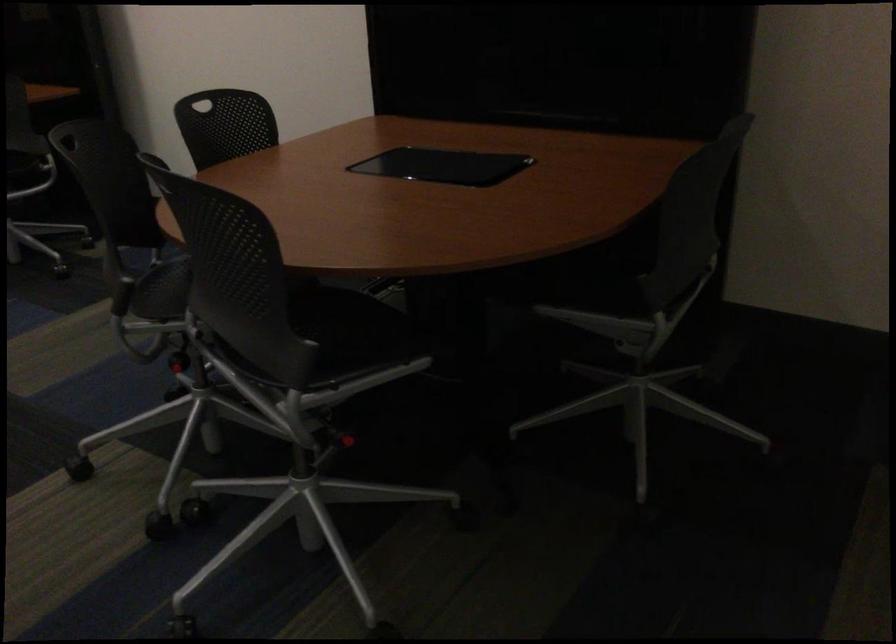
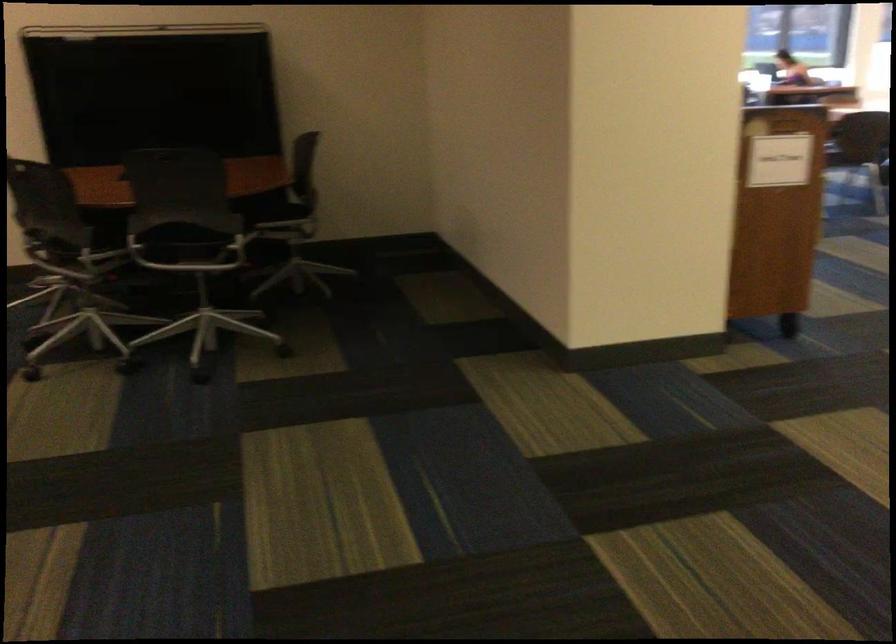
The point at (522, 521) is marked in the first image. Where is the corresponding point in the second image?

(256, 237)